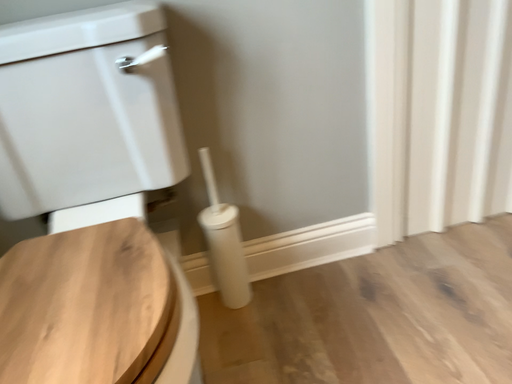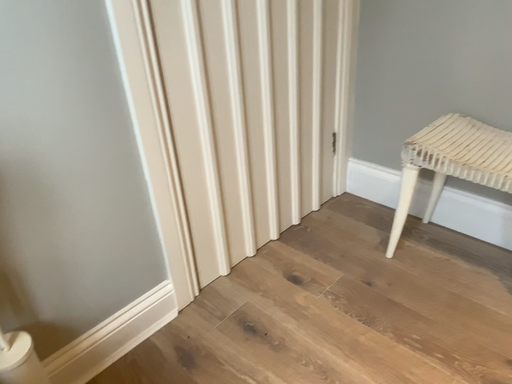
Question: How did the camera likely rotate when shooting the video?

Choices:
 (A) rotated downward
 (B) rotated upward

Answer: (B)